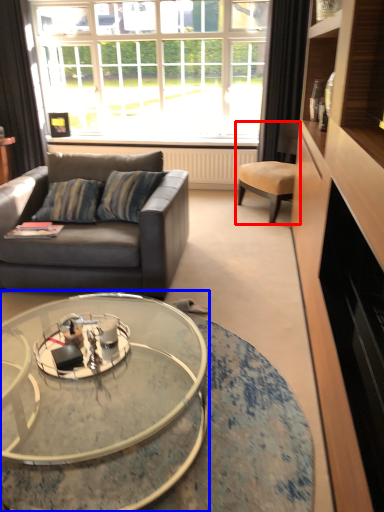
Question: Which of the following is the farthest to the observer, chair (highlighted by a red box) or coffee table (highlighted by a blue box)?

Choices:
 (A) chair
 (B) coffee table

Answer: (A)